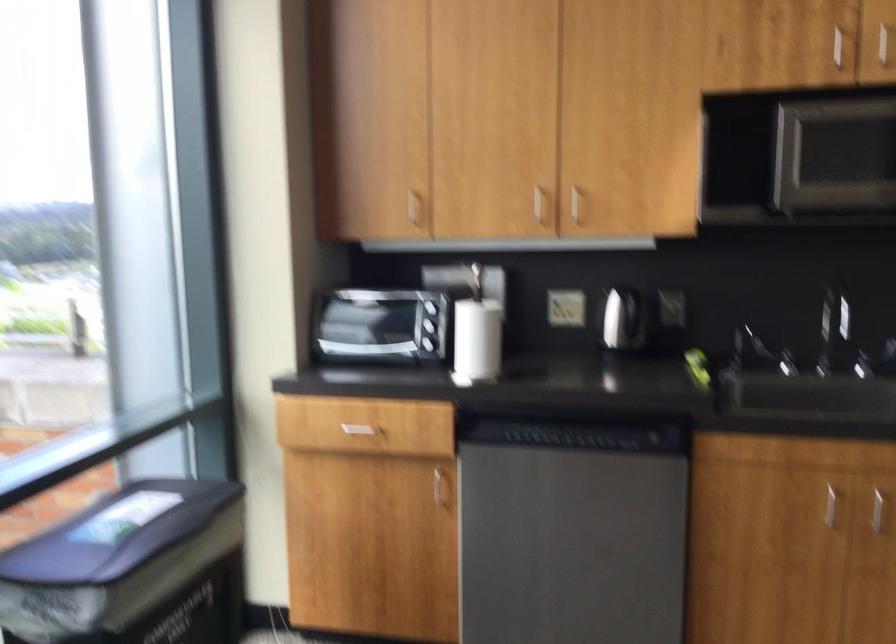
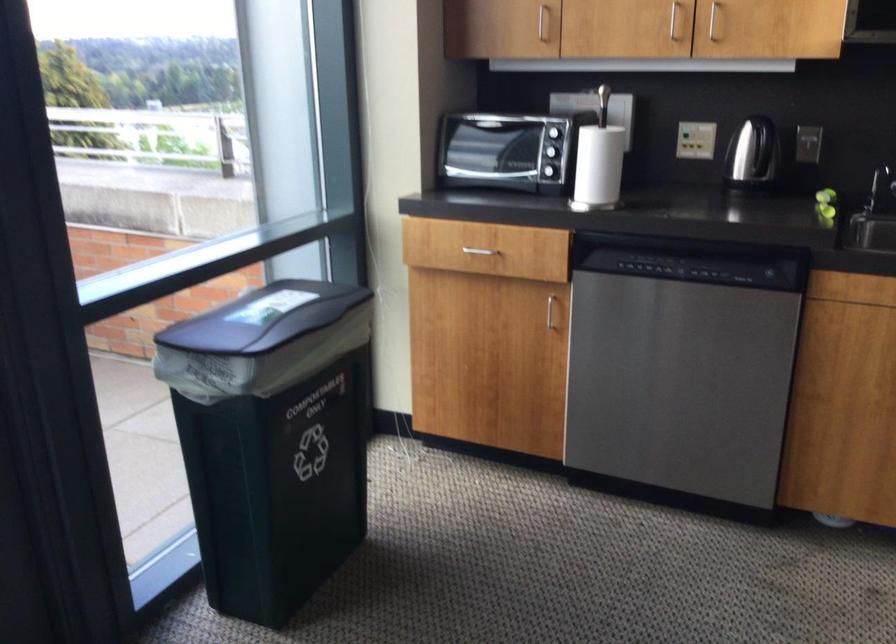
Where in the second image is the point corresponding to the point at 547,202 from the first image?

(673, 20)